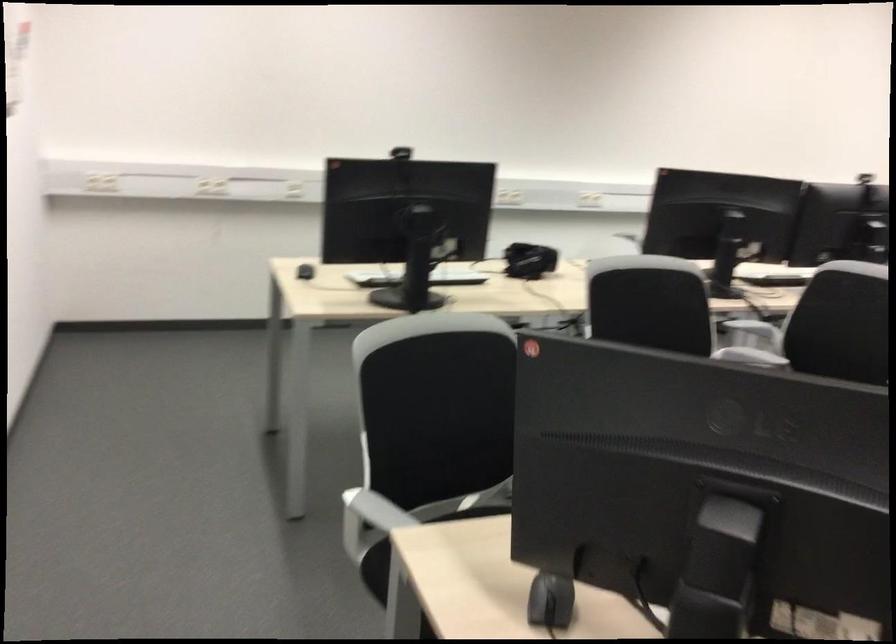
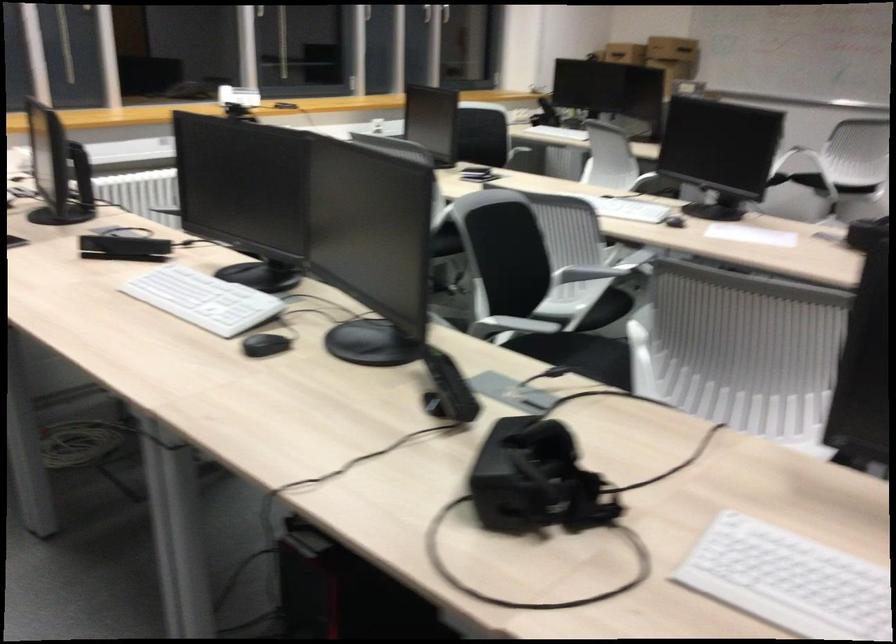
The point at (509, 248) is marked in the first image. Where is the corresponding point in the second image?

(536, 480)